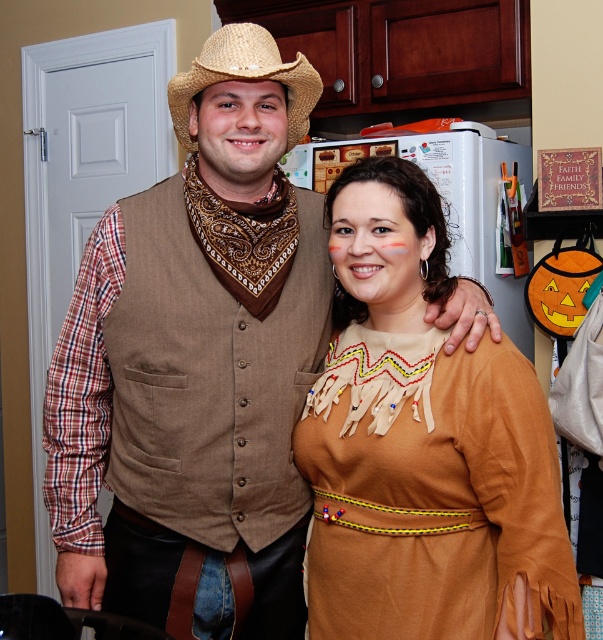
Is brown woven vest at center behind strawhat at center?

No, it is not.

Is point (140, 276) closer to viewer compared to point (302, 104)?

Yes.

Does point (65, 444) lie behind point (186, 84)?

Yes, it is behind point (186, 84).

Locate an element on the screen. brown woven vest at center is located at coordinates (197, 365).

Is brown woven vest at center smaller than brown leather dress at center?

No.

Who is lower down, brown woven vest at center or brown leather dress at center?

brown leather dress at center

Who is more distant from viewer, (277, 358) or (320, 589)?

The point (277, 358) is more distant.

The width and height of the screenshot is (603, 640). Find the location of `brown woven vest at center`. brown woven vest at center is located at coordinates (197, 365).

Which is more to the right, brown leather dress at center or strawhat at center?

Positioned to the right is brown leather dress at center.

Does brown leather dress at center lie behind strawhat at center?

That is False.

Find the location of a particular element. This screenshot has height=640, width=603. brown leather dress at center is located at coordinates (423, 445).

Locate an element on the screen. The image size is (603, 640). brown leather dress at center is located at coordinates (423, 445).